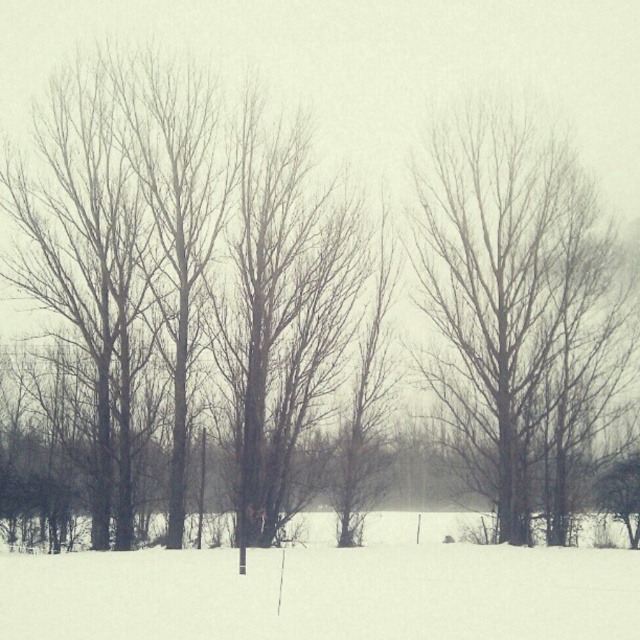
Is bare wood tree at right to the right of white powdery snow at lower center from the viewer's perspective?

Correct, you'll find bare wood tree at right to the right of white powdery snow at lower center.

Which is more to the left, bare wood tree at right or white powdery snow at lower center?

white powdery snow at lower center is more to the left.

Measure the distance between bare wood tree at right and camera.

The distance of bare wood tree at right from camera is 42.06 meters.

Locate an element on the screen. The width and height of the screenshot is (640, 640). bare wood tree at right is located at coordinates (516, 304).